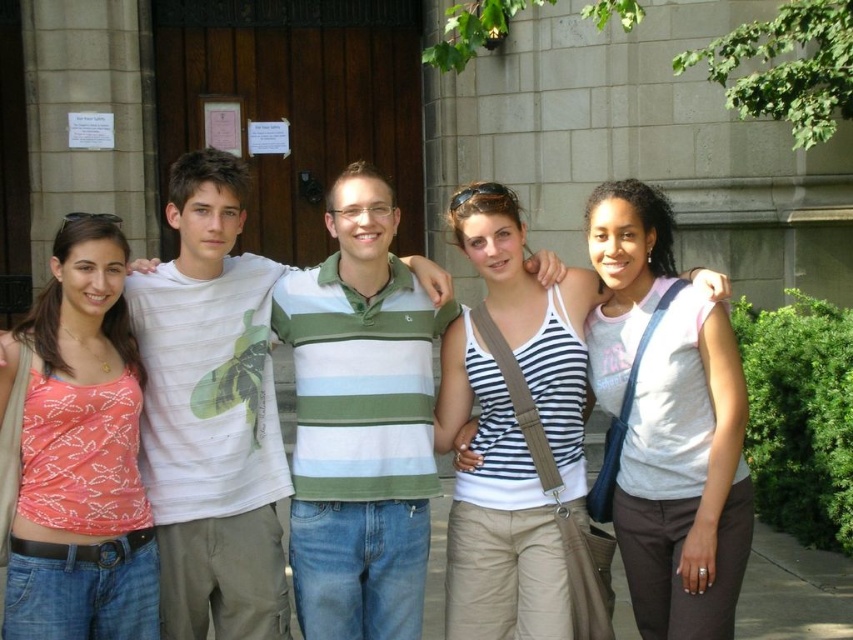
Does striped cotton tank top at center have a larger size compared to matte coral tank top at left?

Correct, striped cotton tank top at center is larger in size than matte coral tank top at left.

Measure the distance between striped cotton tank top at center and camera.

striped cotton tank top at center is 10.12 meters from camera.

Where is `striped cotton tank top at center`? The width and height of the screenshot is (853, 640). striped cotton tank top at center is located at coordinates (515, 436).

Does white cotton tank top at center have a greater width compared to matte coral tank top at left?

Indeed, white cotton tank top at center has a greater width compared to matte coral tank top at left.

Can you confirm if white cotton tank top at center is taller than matte coral tank top at left?

Correct, white cotton tank top at center is much taller as matte coral tank top at left.

Does point (653, 353) come closer to viewer compared to point (84, 556)?

No, (653, 353) is behind (84, 556).

Find the location of a particular element. The height and width of the screenshot is (640, 853). white cotton tank top at center is located at coordinates (685, 477).

What do you see at coordinates (685, 477) in the screenshot? I see `white cotton tank top at center` at bounding box center [685, 477].

Can you confirm if white cotton tank top at center is shorter than white cotton t-shirt at center?

Incorrect, white cotton tank top at center's height does not fall short of white cotton t-shirt at center's.

I want to click on white cotton tank top at center, so click(x=685, y=477).